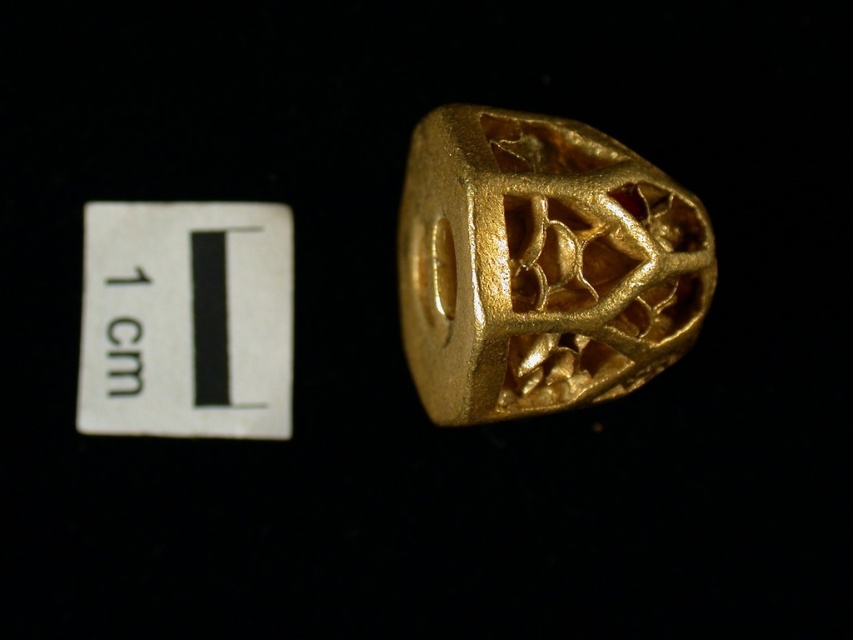
Does point (624, 276) lie behind point (181, 349)?

No.

Is point (463, 257) less distant than point (283, 243)?

Yes, it is.

You are a GUI agent. You are given a task and a screenshot of the screen. Output one action in this format:
    pyautogui.click(x=<x>, y=<y>)
    Task: Click on the gold matte ring at center
    
    Given the screenshot: What is the action you would take?
    pyautogui.click(x=541, y=266)